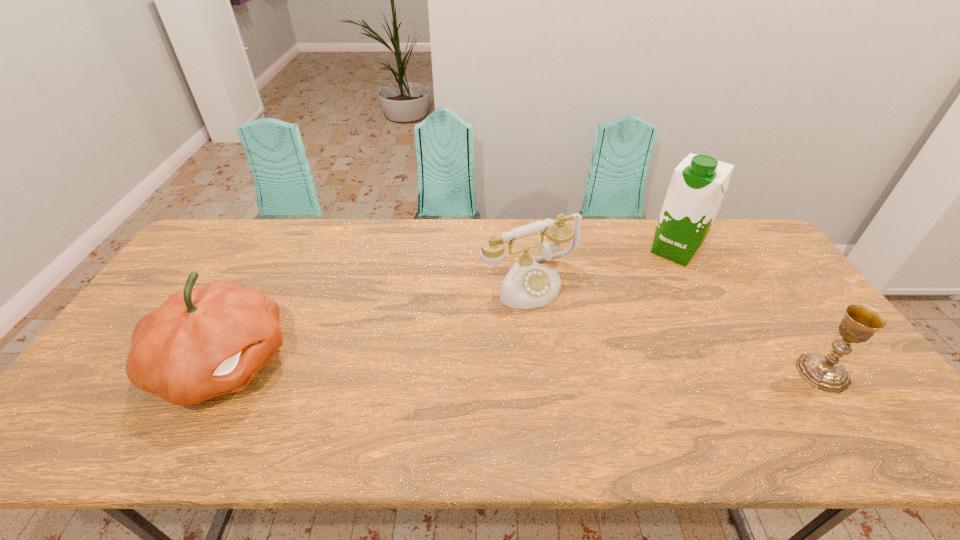
I want to click on object at the near left corner, so tap(202, 342).

This screenshot has height=540, width=960. I want to click on object located at the near right corner, so click(860, 322).

At what (x,y) coordinates should I click in order to perform the action: click on vacant space at the far edge. Please return your answer as a coordinate pair (x, y). This screenshot has height=540, width=960. Looking at the image, I should click on (586, 253).

This screenshot has height=540, width=960. In order to click on vacant area at the near edge in this screenshot , I will do `click(244, 409)`.

In the image, there is a desktop. Find the location of `free space at the right edge`. free space at the right edge is located at coordinates (802, 346).

Where is `vacant space at the far left corner of the desktop`? The height and width of the screenshot is (540, 960). vacant space at the far left corner of the desktop is located at coordinates (226, 254).

This screenshot has height=540, width=960. Find the location of `free space at the far right corner of the desktop`. free space at the far right corner of the desktop is located at coordinates (756, 251).

Image resolution: width=960 pixels, height=540 pixels. Identify the location of free space at the near right corner. (876, 399).

This screenshot has height=540, width=960. In order to click on free point between the third object from right to left and the second tallest object in this screenshot , I will do `click(376, 323)`.

Locate an element on the screen. unoccupied area between the leftmost object and the rightmost object is located at coordinates (523, 368).